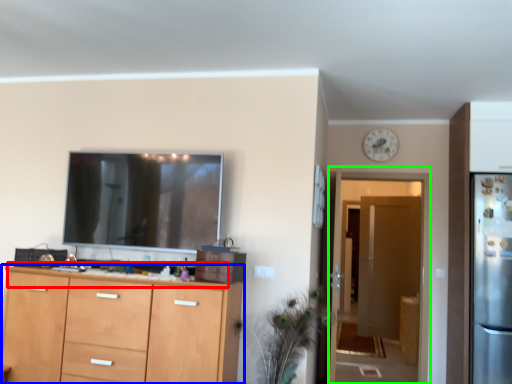
Question: Based on their relative distances, which object is farther from counter top (highlighted by a red box)? Choose from cabinetry (highlighted by a blue box) and glass door (highlighted by a green box).

Choices:
 (A) cabinetry
 (B) glass door

Answer: (B)